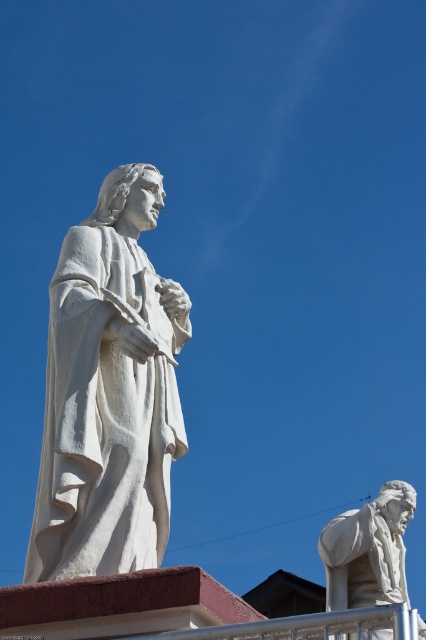
You are standing in front of the two statues. The statue on the left is larger and more prominent. You want to place a small flower bouquet exactly at the point with coordinates point (109, 392). Where should you place the bouquet relative to the statues?

The point (109, 392) corresponds to the white marble statue at left, so you should place the bouquet at the base of the white marble statue at left.

You are an art student standing in front of two statues. You notice the white marble statue at left and the white marble statue at lower right. Which statue is closer to you?

The white marble statue at left is closer to you because it is further to the viewer than the white marble statue at lower right.

You are standing in front of two statues in the image. You want to place a small flower pot between the two points labeled as point (124, 444) and point (354, 577). Since the flower pot is 0.1 meters tall, will it be visible from your current position?

Point (124, 444) is closer to the camera than point (354, 577). The flower pot placed between them will be visible from your current position because it is placed between two points where one is closer and the other is farther away, so the pot will not be entirely hidden.